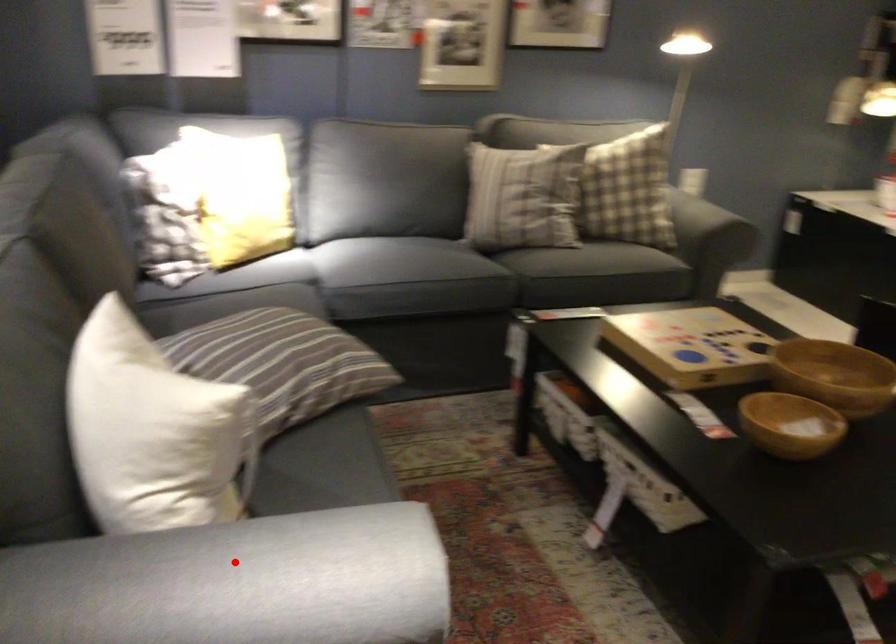
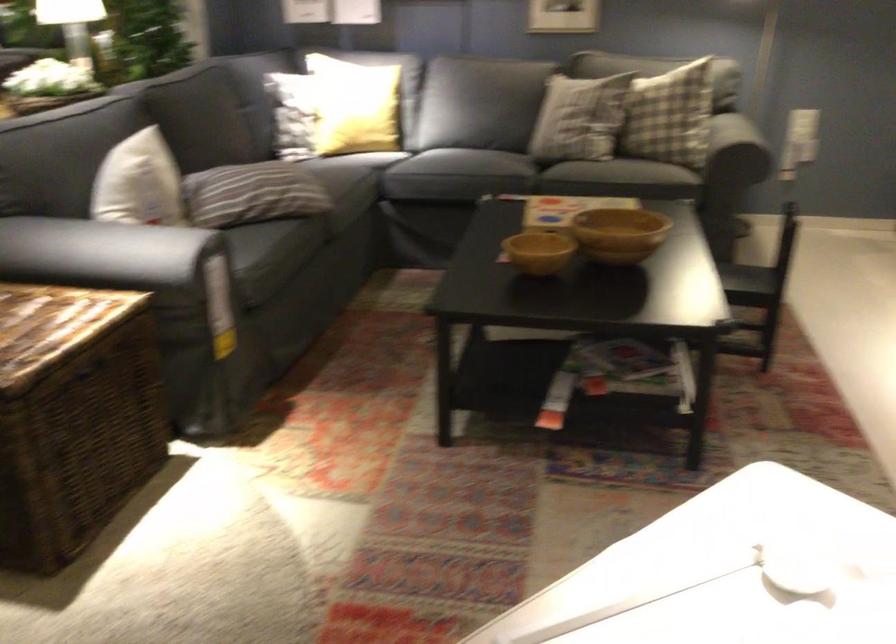
Where in the second image is the point corresponding to the highlighted location from the first image?

(117, 252)